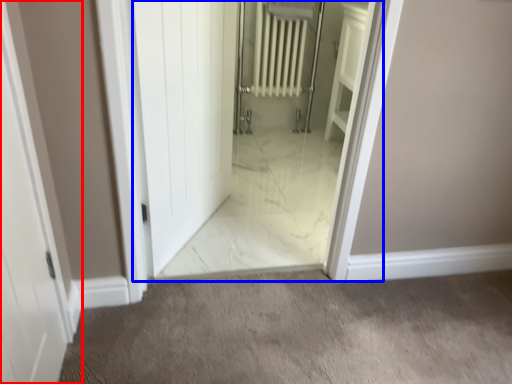
Question: Which point is closer to the camera, door (highlighted by a red box) or elevator (highlighted by a blue box)?

Choices:
 (A) door
 (B) elevator

Answer: (A)